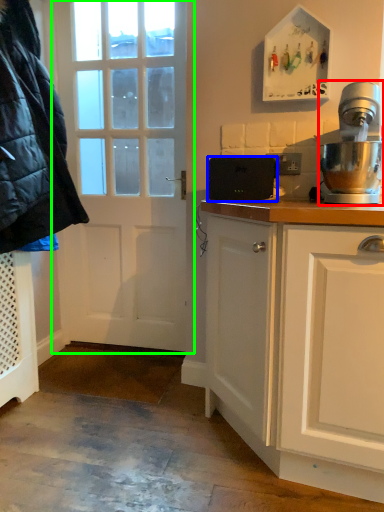
Question: Considering the real-world distances, which object is closest to home appliance (highlighted by a red box)? appliance (highlighted by a blue box) or door (highlighted by a green box).

Choices:
 (A) appliance
 (B) door

Answer: (A)